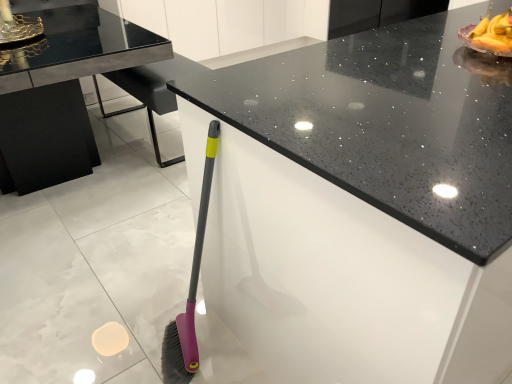
Question: Can you confirm if black speckled granite countertop at center is thinner than black glass table at upper left?

Choices:
 (A) no
 (B) yes

Answer: (B)

Question: Is black glass table at upper left completely or partially inside black speckled granite countertop at center?

Choices:
 (A) yes
 (B) no

Answer: (B)

Question: From a real-world perspective, is black speckled granite countertop at center positioned over black glass table at upper left based on gravity?

Choices:
 (A) yes
 (B) no

Answer: (A)

Question: Can you confirm if black speckled granite countertop at center is positioned to the left of black glass table at upper left?

Choices:
 (A) yes
 (B) no

Answer: (B)

Question: From a real-world perspective, is black speckled granite countertop at center positioned under black glass table at upper left based on gravity?

Choices:
 (A) yes
 (B) no

Answer: (B)

Question: Is black speckled granite countertop at center wider than black glass table at upper left?

Choices:
 (A) no
 (B) yes

Answer: (A)

Question: Does black glass table at upper left come behind black speckled granite countertop at center?

Choices:
 (A) no
 (B) yes

Answer: (B)

Question: Can you see black glass table at upper left touching black speckled granite countertop at center?

Choices:
 (A) yes
 (B) no

Answer: (B)

Question: Does black glass table at upper left turn towards black speckled granite countertop at center?

Choices:
 (A) yes
 (B) no

Answer: (B)

Question: Is black glass table at upper left bigger than black speckled granite countertop at center?

Choices:
 (A) yes
 (B) no

Answer: (B)

Question: From a real-world perspective, is black glass table at upper left physically above black speckled granite countertop at center?

Choices:
 (A) yes
 (B) no

Answer: (B)

Question: Does black glass table at upper left have a lesser width compared to black speckled granite countertop at center?

Choices:
 (A) yes
 (B) no

Answer: (B)

Question: Is black speckled granite countertop at center inside or outside of black glass table at upper left?

Choices:
 (A) outside
 (B) inside

Answer: (A)